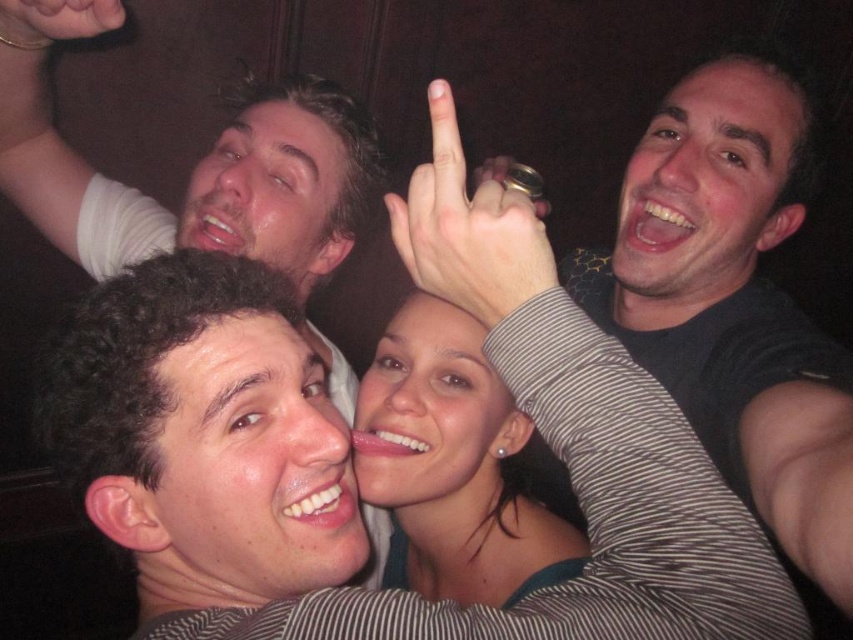
Based on the photo, in the image, where is the black matte shirt at upper right located in terms of coordinates?

The black matte shirt at upper right is located at coordinates point (x=740, y=298).

You are standing in front of a group photo of four people at a bar. You notice two points in the image labeled as point 1 at coordinates (724, 314) and point 2 at (389, 548). Which point is nearer to you?

Point 1 at coordinates (724, 314) is closer to the viewer than point 2 at (389, 548).